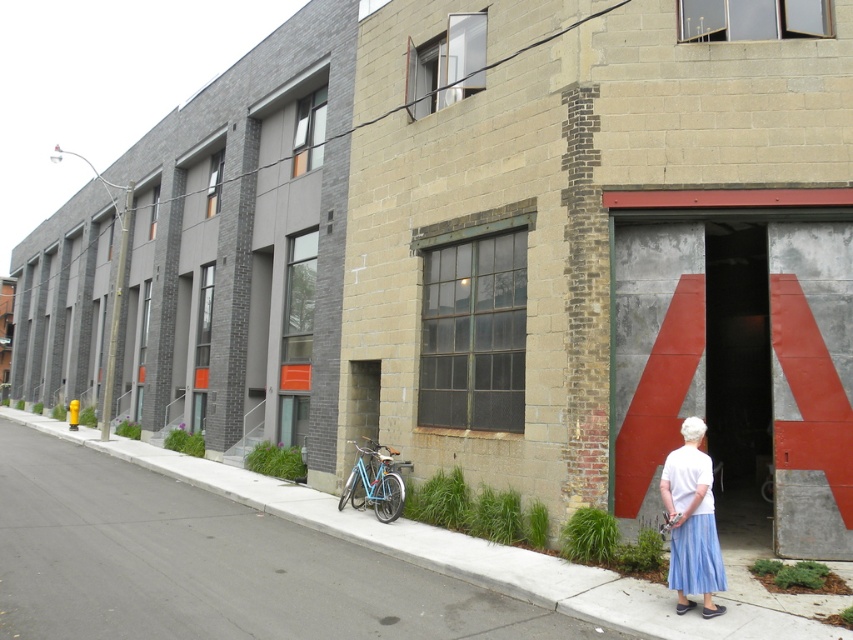
Question: Based on their relative distances, which object is nearer to the light blue matte bicycle at lower center?

Choices:
 (A) gray asphalt pavement at lower center
 (B) light blue pleated skirt at lower right

Answer: (A)

Question: Is light blue pleated skirt at lower right to the left of light blue matte bicycle at lower center from the viewer's perspective?

Choices:
 (A) no
 (B) yes

Answer: (A)

Question: Among these objects, which one is nearest to the camera?

Choices:
 (A) light blue matte bicycle at lower center
 (B) gray asphalt pavement at lower center

Answer: (B)

Question: Which point is farther to the camera?

Choices:
 (A) (705, 570)
 (B) (474, 540)
 (C) (392, 508)

Answer: (C)

Question: Can you confirm if light blue pleated skirt at lower right is bigger than light blue matte bicycle at lower center?

Choices:
 (A) no
 (B) yes

Answer: (A)

Question: Is gray asphalt pavement at lower center wider than light blue pleated skirt at lower right?

Choices:
 (A) no
 (B) yes

Answer: (B)